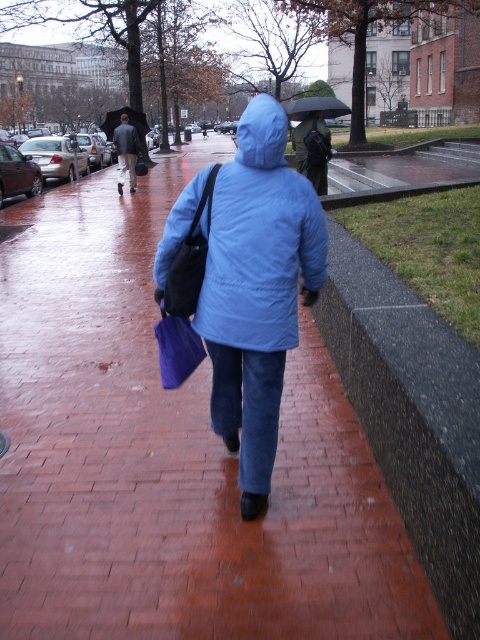
Question: In this image, where is matte black jacket at upper left located relative to black matte umbrella at upper left?

Choices:
 (A) left
 (B) right

Answer: (B)

Question: Considering the real-world distances, which object is closest to the matte black jacket at upper left?

Choices:
 (A) brick pavement at center
 (B) black matte umbrella at upper left
 (C) black matte umbrella at upper center
 (D) matte blue jacket at center

Answer: (B)

Question: Does matte blue jacket at center appear over matte black jacket at upper left?

Choices:
 (A) yes
 (B) no

Answer: (B)

Question: Among these points, which one is farthest from the camera?

Choices:
 (A) (334, 97)
 (B) (156, 269)

Answer: (A)

Question: Is matte blue jacket at center to the left of black matte umbrella at upper center from the viewer's perspective?

Choices:
 (A) no
 (B) yes

Answer: (B)

Question: Which object appears closest to the camera in this image?

Choices:
 (A) matte black jacket at upper left
 (B) matte blue jacket at center
 (C) brick pavement at center

Answer: (C)